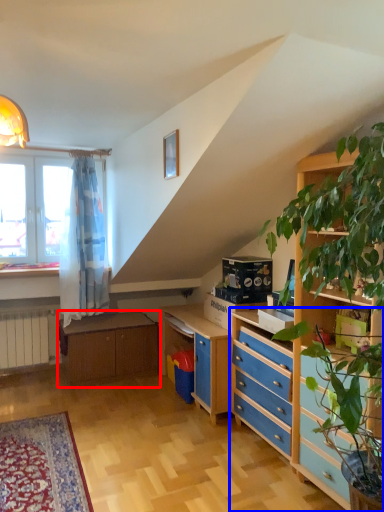
Question: Which object appears farthest to the camera in this image, table (highlighted by a red box) or chest of drawers (highlighted by a blue box)?

Choices:
 (A) table
 (B) chest of drawers

Answer: (A)